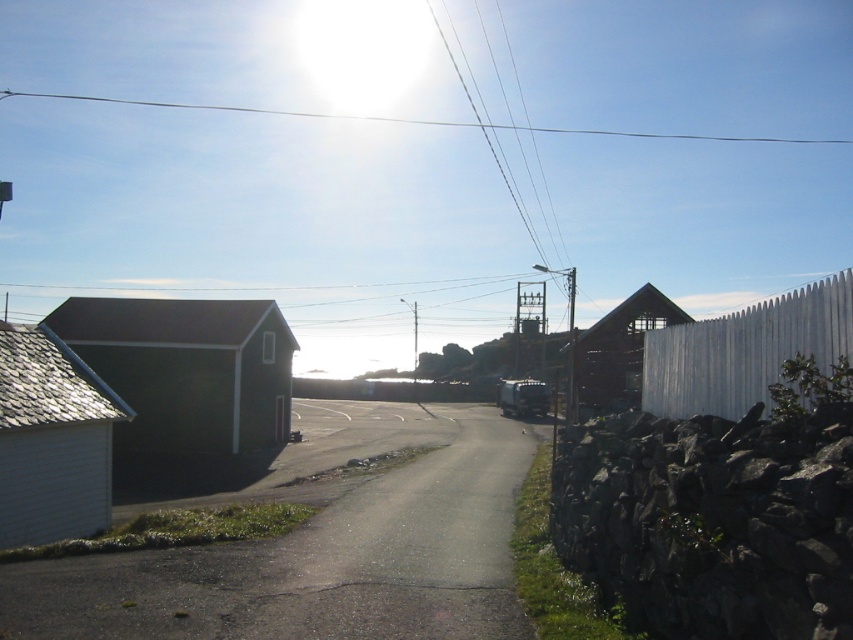
You are standing at the starting point of the road in the image. There are two points marked on the road, one at coordinates point [607,392] and the other at point [773,138]. Which point is closer to you?

Point [607,392] is in front of point [773,138], so it is closer to you.

Looking at this image, you are standing on the road and want to take a photo of the white shiplap siding at left. Where should you position yourself to capture it in the frame?

To capture the white shiplap siding at left in your photo, position yourself at point [51,440].